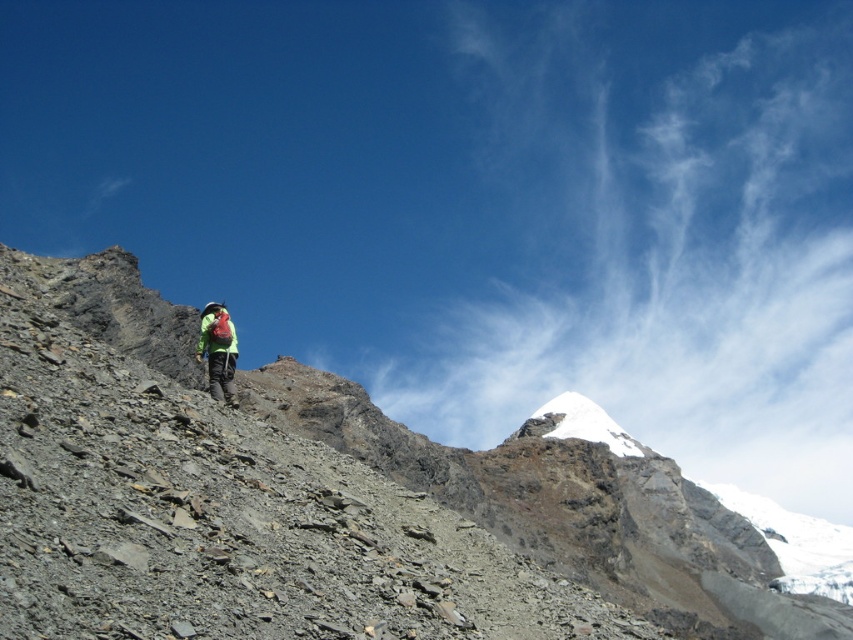
You are a hiker standing at the point with coordinates point (x=555, y=476) and want to reach the point with coordinates point (x=555, y=417). Given the steep rocky incline in the foreground, which direction should you move to get closer to your destination?

Since point (x=555, y=476) is closer to the camera than point (x=555, y=417), you should move towards the direction away from the camera to reach your destination.

Looking at this image, you are a hiker with a 25 meter long rope. You want to climb the rugged stone mountain at center. Can you reach the base of the mountain from your current position with the rope?

The distance between rugged stone mountain at center and camera is 25.63 meters. Since the rope is only 25 meters long, it is not long enough to reach the base of the rugged stone mountain at center.